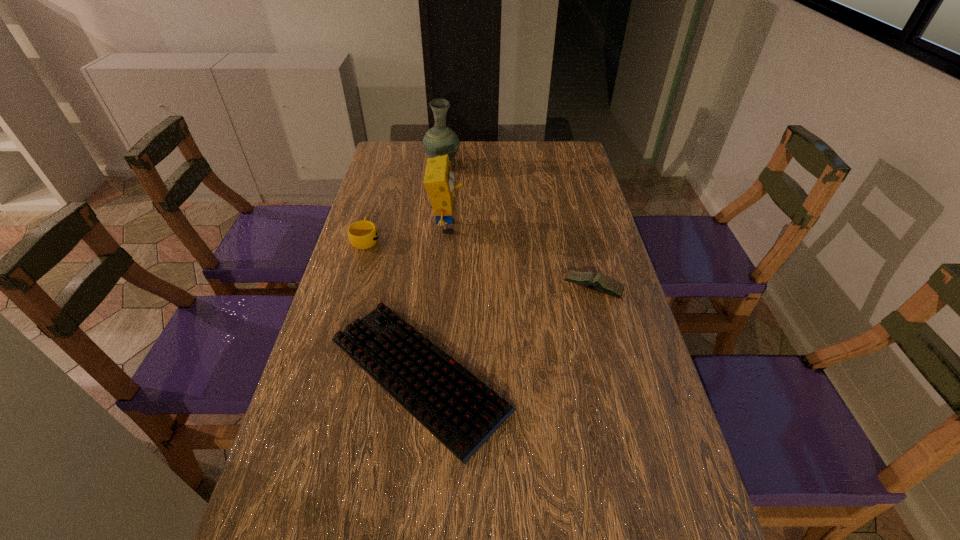
Locate an element on the screen. free location located 0.100m on the back of the rightmost object is located at coordinates (583, 250).

This screenshot has width=960, height=540. I want to click on vacant space located on the back of the shortest object, so click(x=432, y=252).

Find the location of `object that is at the far edge`. object that is at the far edge is located at coordinates (440, 140).

Where is `cup located in the left edge section of the desktop`? This screenshot has height=540, width=960. cup located in the left edge section of the desktop is located at coordinates (363, 234).

The height and width of the screenshot is (540, 960). I want to click on computer keyboard that is at the left edge, so (x=460, y=410).

The width and height of the screenshot is (960, 540). Find the location of `object at the right edge`. object at the right edge is located at coordinates (598, 282).

The height and width of the screenshot is (540, 960). I want to click on blank space at the far edge, so click(463, 156).

Identify the location of vacant space at the left edge of the desktop. The width and height of the screenshot is (960, 540). (377, 228).

Locate an element on the screen. This screenshot has height=540, width=960. free space at the right edge is located at coordinates (586, 201).

Where is `vacant space at the far left corner of the desktop`? This screenshot has width=960, height=540. vacant space at the far left corner of the desktop is located at coordinates (400, 142).